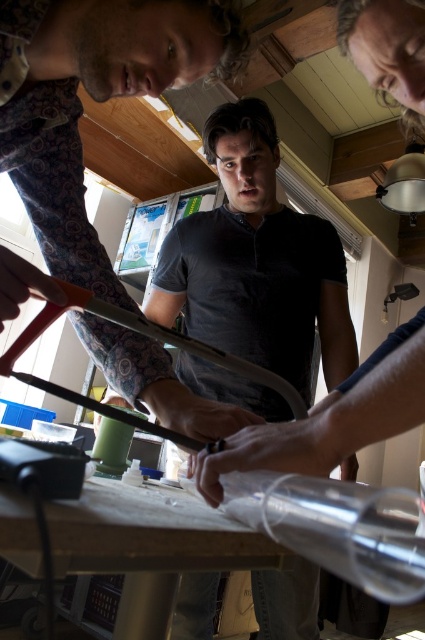
You are organizing a craft workshop and need to place a decorative item on the wooden table at center so that it is above the orange plastic ruler at center. Is this possible given their positions?

The wooden table at center is below the orange plastic ruler at center, so placing a decorative item on the wooden table at center would naturally be above the orange plastic ruler at center. This is possible.

You are a worker who needs to place a 7.5 inch tool on the wooden table at center. Can you place it without it overlapping the orange plastic ruler at center?

The wooden table at center is 6.85 inches away from orange plastic ruler at center. Since the tool is 7.5 inches long, placing it might cause overlap as the distance between them is less than the tool length.

You are standing in the workshop and want to place a 12 inch tool box on the wooden table at center. Can you fit it on the table without moving any items?

The wooden table at center is 11.66 inches away from the viewer, but the distance does not indicate the table size. The question about fitting a 12 inch tool box cannot be answered with the given information.